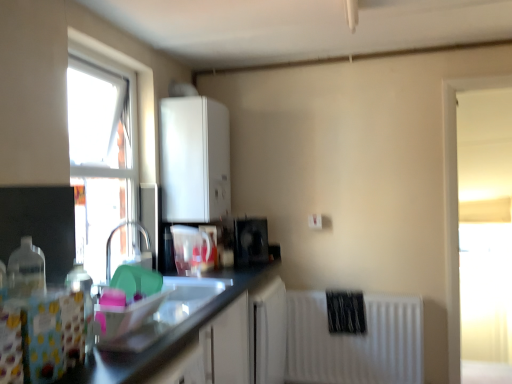
Question: Considering the relative sizes of translucent plastic bottle at left and transparent glass window at right, marked as the second window in a left-to-right arrangement, in the image provided, is translucent plastic bottle at left thinner than transparent glass window at right, marked as the second window in a left-to-right arrangement,?

Choices:
 (A) yes
 (B) no

Answer: (A)

Question: Is translucent plastic bottle at left facing away from transparent glass window at right, placed as the 2th window when sorted from front to back?

Choices:
 (A) no
 (B) yes

Answer: (A)

Question: Is translucent plastic bottle at left smaller than transparent glass window at right, which is the 1th window in back-to-front order?

Choices:
 (A) yes
 (B) no

Answer: (A)

Question: Is translucent plastic bottle at left facing towards transparent glass window at right, which is the 1th window in back-to-front order?

Choices:
 (A) yes
 (B) no

Answer: (B)

Question: Is translucent plastic bottle at left at the left side of transparent glass window at right, marked as the second window in a left-to-right arrangement?

Choices:
 (A) no
 (B) yes

Answer: (B)

Question: From the image's perspective, is translucent plastic bottle at left on top of transparent glass window at right, marked as the second window in a left-to-right arrangement?

Choices:
 (A) no
 (B) yes

Answer: (A)

Question: Is transparent plastic pitcher at center, the 2th appliance from the back, closer to camera compared to transparent glass window at upper left, which ranks as the second window in back-to-front order?

Choices:
 (A) yes
 (B) no

Answer: (B)

Question: Is transparent plastic pitcher at center, the 2th appliance from the back, not inside transparent glass window at upper left, the first window viewed from the left?

Choices:
 (A) no
 (B) yes

Answer: (B)

Question: Could you tell me if transparent plastic pitcher at center, the 2th appliance from the back, is facing transparent glass window at upper left, the first window viewed from the left?

Choices:
 (A) yes
 (B) no

Answer: (B)

Question: Can transparent glass window at upper left, which ranks as the 2th window in right-to-left order, be found inside transparent plastic pitcher at center, the 2th appliance from the back?

Choices:
 (A) yes
 (B) no

Answer: (B)

Question: Considering the relative positions of transparent plastic pitcher at center, which ranks as the first appliance in front-to-back order, and transparent glass window at upper left, placed as the first window when sorted from front to back, in the image provided, is transparent plastic pitcher at center, which ranks as the first appliance in front-to-back order, to the right of transparent glass window at upper left, placed as the first window when sorted from front to back, from the viewer's perspective?

Choices:
 (A) yes
 (B) no

Answer: (A)

Question: Is transparent plastic pitcher at center, which is counted as the 1th appliance, starting from the left, taller than transparent glass window at upper left, which ranks as the 2th window in right-to-left order?

Choices:
 (A) no
 (B) yes

Answer: (A)

Question: Is white matte cabinet at upper center facing towards white matte radiator at lower right?

Choices:
 (A) yes
 (B) no

Answer: (B)